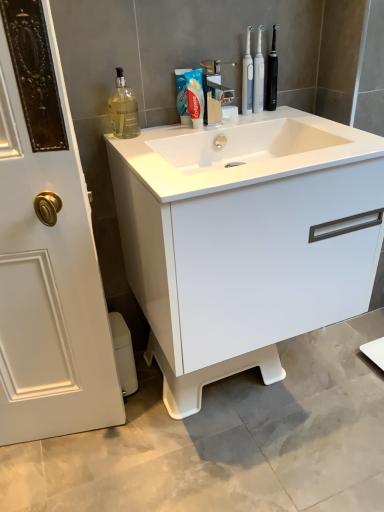
Find the location of a particular element. This screenshot has height=512, width=384. unoccupied region to the right of translucent glass bottle at upper left is located at coordinates (163, 131).